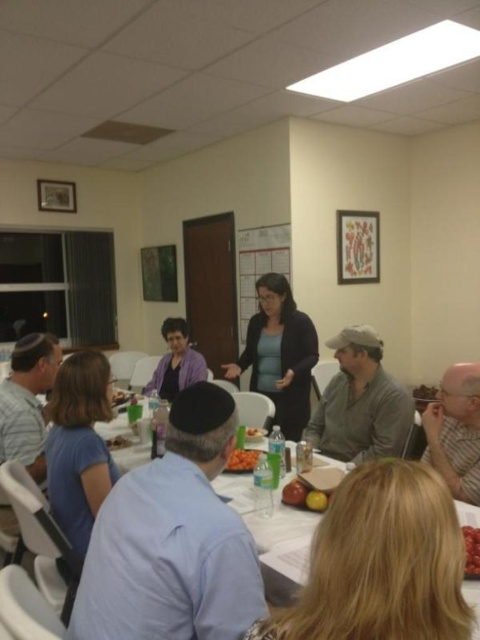
Does dark blue sweater at center have a larger size compared to shiny red grapes at lower right?

Yes.

Is dark blue sweater at center closer to the viewer compared to shiny red grapes at lower right?

No, it is not.

Locate an element on the screen. The image size is (480, 640). dark blue sweater at center is located at coordinates (279, 355).

Identify the location of dark blue sweater at center. (279, 355).

Between white plastic table at lower left and blue fabric shirt at lower left, which one has less height?

With less height is blue fabric shirt at lower left.

Does white plastic table at lower left lie in front of blue fabric shirt at lower left?

Yes, it is.

The width and height of the screenshot is (480, 640). In order to click on white plastic table at lower left in this screenshot , I will do `click(379, 545)`.

From the picture: Who is more distant from viewer, (92, 486) or (285, 497)?

Point (285, 497)

Does blue cotton shirt at lower left have a larger size compared to shiny red apple at center?

Indeed, blue cotton shirt at lower left has a larger size compared to shiny red apple at center.

Is point (80, 358) farther from viewer compared to point (301, 492)?

Yes, it is behind point (301, 492).

Where is `blue cotton shirt at lower left`? The width and height of the screenshot is (480, 640). blue cotton shirt at lower left is located at coordinates (79, 445).